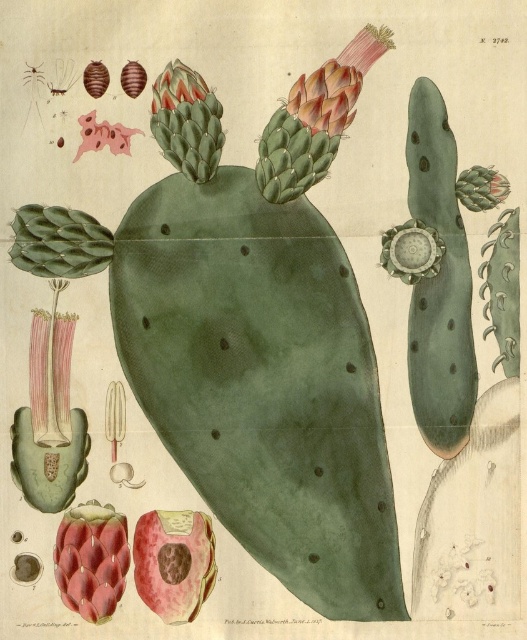
Is point (189, 588) in front of point (118, 144)?

Yes, point (189, 588) is closer to viewer.

Which is above, pink matte flower at center or pink matte flower at upper left?

pink matte flower at upper left is higher up.

Where is `pink matte flower at center`? The image size is (527, 640). pink matte flower at center is located at coordinates (173, 563).

Who is more distant from viewer, (202,97) or (84,132)?

Positioned behind is point (84,132).

Which is below, green matte flower at upper center or pink matte flower at upper left?

pink matte flower at upper left is below.

The width and height of the screenshot is (527, 640). In order to click on green matte flower at upper center in this screenshot , I will do `click(177, 86)`.

Is point (178, 116) behind point (292, 90)?

No.

Can you confirm if green spiky cactus at upper center is shorter than pink matte flower at upper center?

No.

Which is behind, point (197, 148) or point (349, 102)?

The point (197, 148) is behind.

You are a GUI agent. You are given a task and a screenshot of the screen. Output one action in this format:
    pyautogui.click(x=<x>, y=<y>)
    Task: Click on the green spiky cactus at upper center
    Image resolution: width=527 pixels, height=640 pixels.
    Given the screenshot: What is the action you would take?
    pyautogui.click(x=187, y=122)